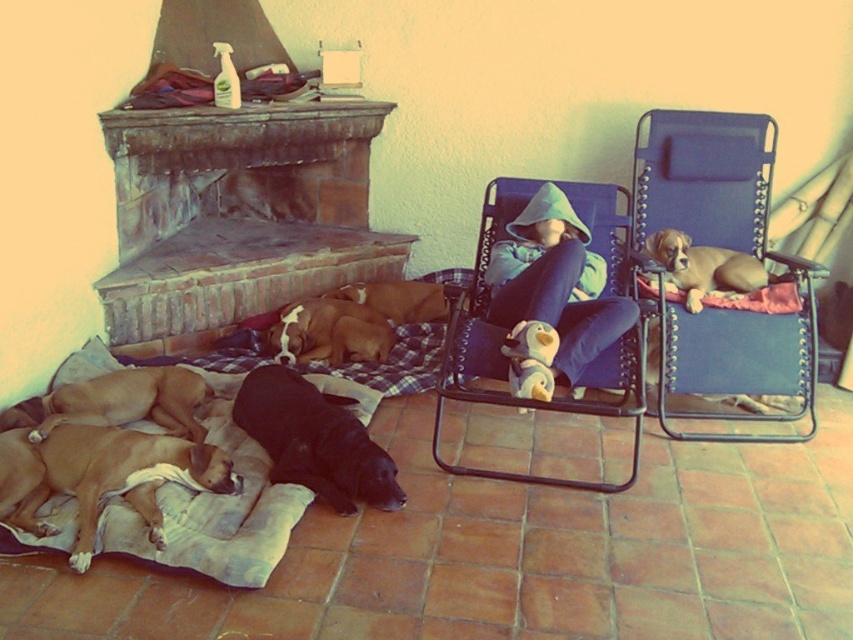
Question: Is green fleece hoodie at center above golden brown fur at right?

Choices:
 (A) no
 (B) yes

Answer: (A)

Question: Which point appears farthest from the camera in this image?

Choices:
 (A) (225, 456)
 (B) (688, 252)
 (C) (260, 474)

Answer: (B)

Question: Which point appears closest to the camera in this image?

Choices:
 (A) (100, 342)
 (B) (361, 500)
 (C) (221, 454)
 (D) (337, 296)

Answer: (C)

Question: Estimate the real-world distances between objects in this image. Which object is closer to the brick fireplace at upper left?

Choices:
 (A) brown fur at center
 (B) soft white fabric dog bed at lower left

Answer: (A)

Question: From the image, what is the correct spatial relationship of golden brown fur at right in relation to brown fur dog at center?

Choices:
 (A) left
 (B) right

Answer: (B)

Question: Is brick fireplace at upper left behind green fleece hoodie at center?

Choices:
 (A) no
 (B) yes

Answer: (B)